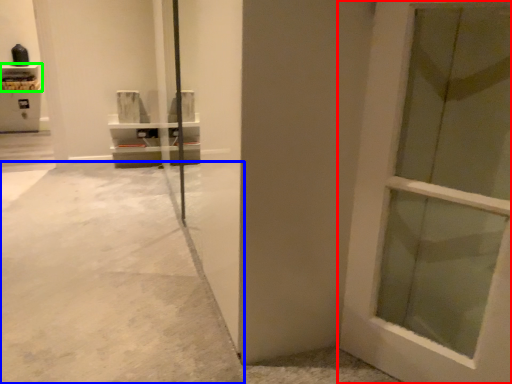
Question: Estimate the real-world distances between objects in this image. Which object is closer to door (highlighted by a red box), concrete (highlighted by a blue box) or shelf (highlighted by a green box)?

Choices:
 (A) concrete
 (B) shelf

Answer: (A)